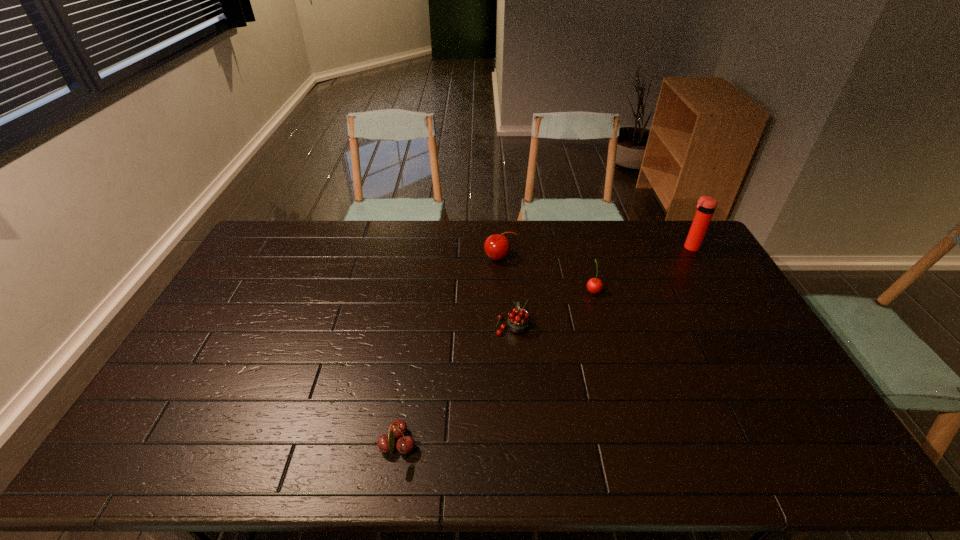
In the image, there is a desktop. Identify the location of vacant region at the far edge. This screenshot has width=960, height=540. pos(589,252).

Identify the location of vacant space at the left edge of the desktop. This screenshot has width=960, height=540. (172, 426).

In the image, there is a desktop. Where is `free space at the right edge`? free space at the right edge is located at coordinates (756, 327).

The image size is (960, 540). In the image, there is a desktop. What are the coordinates of `vacant area at the far left corner` in the screenshot? It's located at (285, 244).

The height and width of the screenshot is (540, 960). Find the location of `vacant region at the near left corner`. vacant region at the near left corner is located at coordinates (132, 449).

This screenshot has height=540, width=960. In order to click on free space at the far right corner of the desktop in this screenshot , I will do `click(669, 250)`.

Where is `free space between the farthest cherry and the third farthest cherry`? Image resolution: width=960 pixels, height=540 pixels. free space between the farthest cherry and the third farthest cherry is located at coordinates (506, 292).

This screenshot has height=540, width=960. I want to click on free area in between the third farthest object and the nearest object, so click(495, 368).

Locate an element on the screen. vacant area between the nearest object and the thermos bottle is located at coordinates point(544,347).

In order to click on empty space between the rightmost cherry and the leftmost object in this screenshot , I will do `click(495, 368)`.